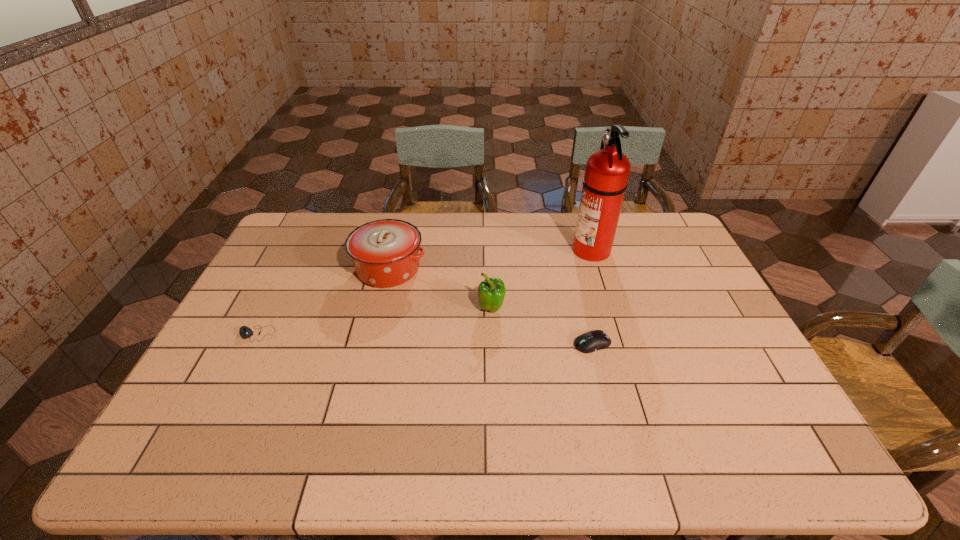
Identify the location of object identified as the fourth closest to the shorter computer mouse. (607, 171).

Select which object appears as the second closest to the second object from left to right. Please provide its 2D coordinates. Your answer should be formatted as a tuple, i.e. [(x, y)], where the tuple contains the x and y coordinates of a point satisfying the conditions above.

[(246, 332)]

At what (x,y) coordinates should I click in order to perform the action: click on free space that satisfies the following two spatial constraints: 1. on the front side of the fourth tallest object; 2. on the right side of the casserole. Please return your answer as a coordinate pair (x, y). Looking at the image, I should click on (371, 343).